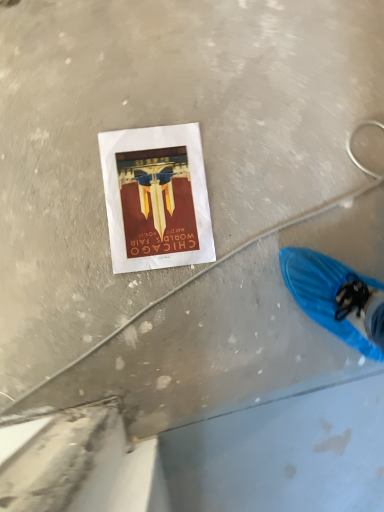
What is the approximate height of matte paper poster at center?

matte paper poster at center is 0.45 inches tall.

Describe the element at coordinates (156, 198) in the screenshot. I see `matte paper poster at center` at that location.

This screenshot has width=384, height=512. I want to click on matte paper poster at center, so click(156, 198).

Locate an element on the screen. The width and height of the screenshot is (384, 512). matte paper poster at center is located at coordinates (156, 198).